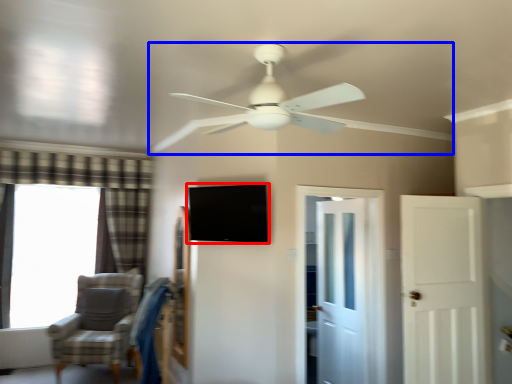
Question: Which of the following is the farthest to the observer, window screen (highlighted by a red box) or ceiling fan (highlighted by a blue box)?

Choices:
 (A) window screen
 (B) ceiling fan

Answer: (A)